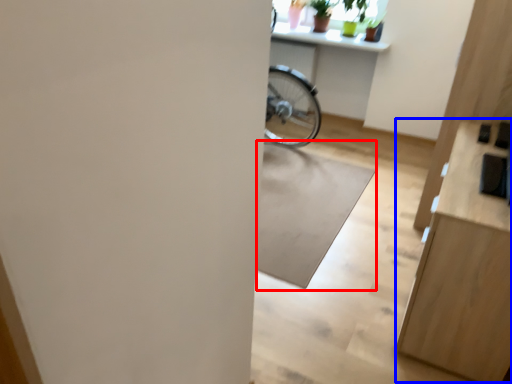
Question: Which point is closer to the camera, mat (highlighted by a red box) or dresser (highlighted by a blue box)?

Choices:
 (A) mat
 (B) dresser

Answer: (B)